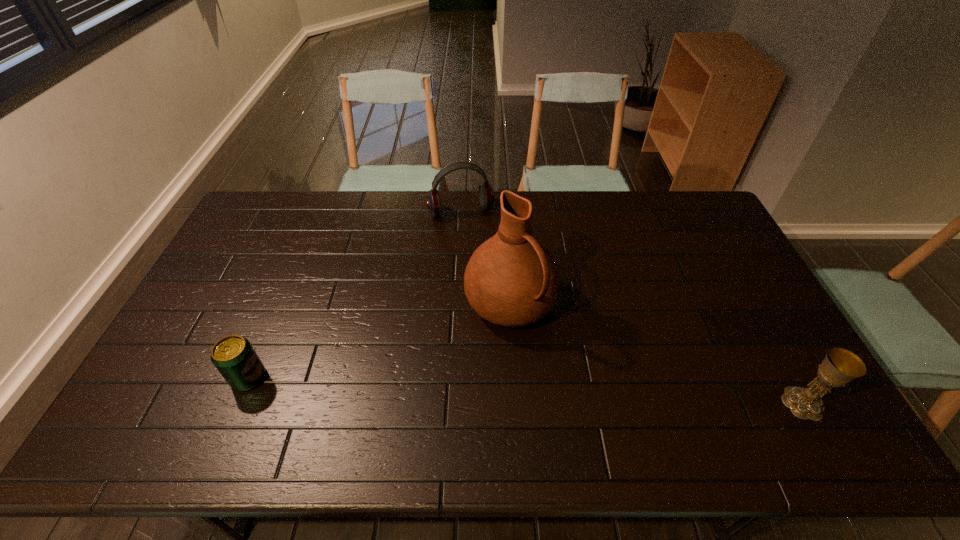
Identify the location of free space at the right edge of the desktop. (732, 292).

You are a GUI agent. You are given a task and a screenshot of the screen. Output one action in this format:
    pyautogui.click(x=<x>, y=<y>)
    Task: Click on the free space at the near left corner of the desktop
    This screenshot has width=960, height=540.
    Given the screenshot: What is the action you would take?
    pyautogui.click(x=186, y=390)

At what (x,y) coordinates should I click in order to perform the action: click on vacant space at the far right corner of the desktop. Please return your answer as a coordinate pair (x, y). The height and width of the screenshot is (540, 960). Looking at the image, I should click on (698, 194).

At what (x,y) coordinates should I click in order to perform the action: click on unoccupied position between the beer can and the second farthest object. Please return your answer as a coordinate pair (x, y). The image size is (960, 540). Looking at the image, I should click on click(379, 340).

The image size is (960, 540). In order to click on vacant space in between the rightmost object and the earphone in this screenshot , I will do `click(632, 307)`.

At what (x,y) coordinates should I click in order to perform the action: click on blank region between the rightmost object and the leftmost object. Please return your answer as a coordinate pair (x, y). Looking at the image, I should click on (526, 390).

You are a GUI agent. You are given a task and a screenshot of the screen. Output one action in this format:
    pyautogui.click(x=<x>, y=<y>)
    Task: Click on the free area in between the rightmost object and the tallest object
    The image size is (960, 540).
    Given the screenshot: What is the action you would take?
    pyautogui.click(x=657, y=353)

What are the coordinates of `vacant space that is in between the rightmost object and the farthest object` in the screenshot? It's located at (632, 307).

Locate an element on the screen. The height and width of the screenshot is (540, 960). blank region between the earphone and the leftmost object is located at coordinates (355, 294).

The image size is (960, 540). In order to click on free spot between the rightmost object and the third nearest object in this screenshot , I will do `click(657, 353)`.